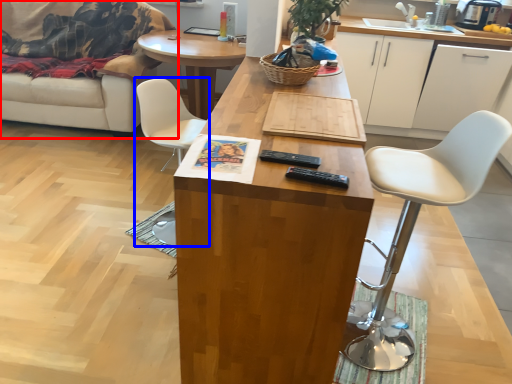
Question: Among these objects, which one is farthest to the camera, studio couch (highlighted by a red box) or chair (highlighted by a blue box)?

Choices:
 (A) studio couch
 (B) chair

Answer: (A)